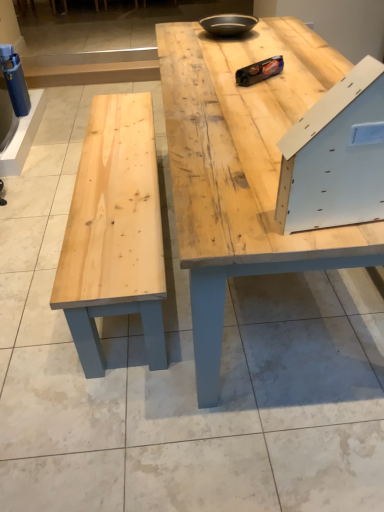
Question: Does white matte drawer at upper right appear on the left side of natural wood table at center?

Choices:
 (A) no
 (B) yes

Answer: (A)

Question: Considering the relative positions of white matte drawer at upper right and natural wood table at center in the image provided, is white matte drawer at upper right in front of natural wood table at center?

Choices:
 (A) yes
 (B) no

Answer: (A)

Question: Does white matte drawer at upper right come behind natural wood table at center?

Choices:
 (A) yes
 (B) no

Answer: (B)

Question: From a real-world perspective, does white matte drawer at upper right stand above natural wood table at center?

Choices:
 (A) yes
 (B) no

Answer: (A)

Question: From the image's perspective, would you say white matte drawer at upper right is shown under natural wood table at center?

Choices:
 (A) no
 (B) yes

Answer: (B)

Question: From the image's perspective, is white matte drawer at upper right on natural wood table at center?

Choices:
 (A) no
 (B) yes

Answer: (A)

Question: Can you confirm if matte black bowl at upper center is taller than natural wood table at center?

Choices:
 (A) yes
 (B) no

Answer: (B)

Question: Is matte black bowl at upper center far from natural wood table at center?

Choices:
 (A) no
 (B) yes

Answer: (A)

Question: Is matte black bowl at upper center wider than natural wood table at center?

Choices:
 (A) no
 (B) yes

Answer: (A)

Question: Is matte black bowl at upper center surrounding natural wood table at center?

Choices:
 (A) yes
 (B) no

Answer: (B)

Question: Considering the relative sizes of matte black bowl at upper center and natural wood table at center in the image provided, is matte black bowl at upper center bigger than natural wood table at center?

Choices:
 (A) no
 (B) yes

Answer: (A)

Question: Can you confirm if matte black bowl at upper center is shorter than natural wood table at center?

Choices:
 (A) yes
 (B) no

Answer: (A)

Question: Would you consider natural wood table at center to be distant from matte black bowl at upper center?

Choices:
 (A) yes
 (B) no

Answer: (B)